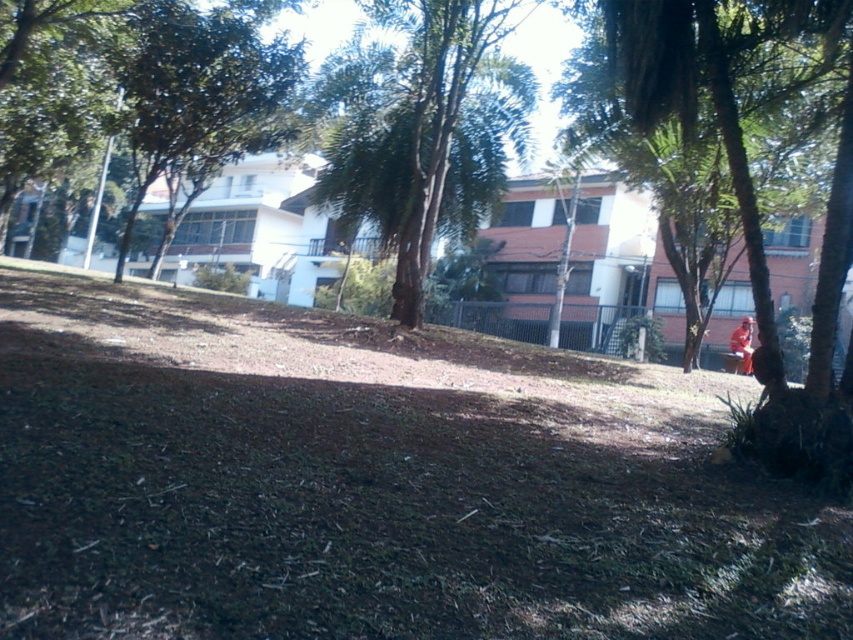
Between green leafy tree at center and orange fabric person at lower right, which one has less height?

With less height is orange fabric person at lower right.

In the scene shown: Who is lower down, green leafy tree at center or orange fabric person at lower right?

orange fabric person at lower right

Between point (345, 52) and point (753, 323), which one is positioned behind?

The point (753, 323) is behind.

You are a GUI agent. You are given a task and a screenshot of the screen. Output one action in this format:
    pyautogui.click(x=<x>, y=<y>)
    Task: Click on the green leafy tree at center
    
    Given the screenshot: What is the action you would take?
    pyautogui.click(x=421, y=125)

Does point (131, 243) lie in front of point (750, 332)?

No, it is behind (750, 332).

Is green leafy tree at upper left below orange fabric person at lower right?

Actually, green leafy tree at upper left is above orange fabric person at lower right.

Is point (271, 61) positioned before point (749, 342)?

Yes, point (271, 61) is in front of point (749, 342).

The width and height of the screenshot is (853, 640). I want to click on green leafy tree at upper left, so click(201, 106).

Who is more forward, (474, 170) or (239, 35)?

Point (239, 35) is in front.

Which of these two, green leafy tree at center or green leafy tree at upper left, stands shorter?

green leafy tree at center

Where is `green leafy tree at center`? The image size is (853, 640). green leafy tree at center is located at coordinates (421, 125).

The image size is (853, 640). In order to click on green leafy tree at center in this screenshot , I will do `click(421, 125)`.